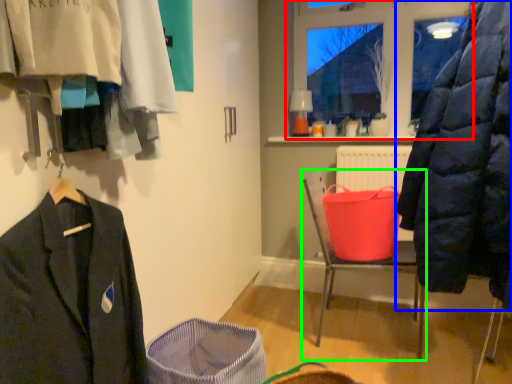
Question: Which is nearer to the window (highlighted by a red box)? coat (highlighted by a blue box) or furniture (highlighted by a green box).

Choices:
 (A) coat
 (B) furniture

Answer: (B)